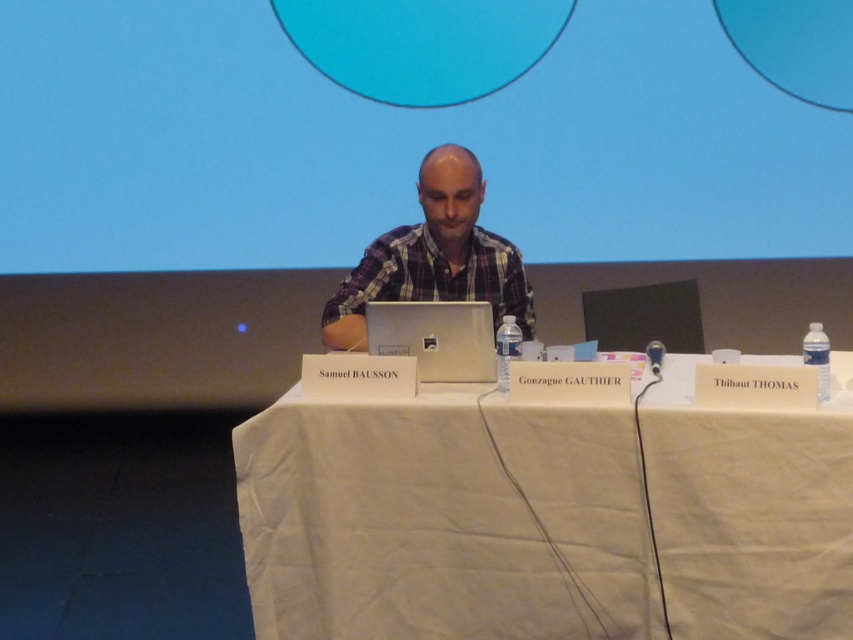
Is the position of plaid fabric shirt at center less distant than that of silver metallic laptop at center?

No.

Who is positioned more to the left, plaid fabric shirt at center or silver metallic laptop at center?

From the viewer's perspective, plaid fabric shirt at center appears more on the left side.

Is point (370, 300) farther from viewer compared to point (425, 369)?

Yes, point (370, 300) is farther from viewer.

You are a GUI agent. You are given a task and a screenshot of the screen. Output one action in this format:
    pyautogui.click(x=<x>, y=<y>)
    Task: Click on the plaid fabric shirt at center
    
    Given the screenshot: What is the action you would take?
    pyautogui.click(x=434, y=257)

Who is positioned more to the right, blue matte projection screen at upper center or plaid fabric shirt at center?

From the viewer's perspective, plaid fabric shirt at center appears more on the right side.

Based on the photo, can you confirm if blue matte projection screen at upper center is bigger than plaid fabric shirt at center?

Yes.

The width and height of the screenshot is (853, 640). Describe the element at coordinates (393, 145) in the screenshot. I see `blue matte projection screen at upper center` at that location.

At what (x,y) coordinates should I click in order to perform the action: click on blue matte projection screen at upper center. Please return your answer as a coordinate pair (x, y). Looking at the image, I should click on (393, 145).

Measure the distance between white cloth table at center and camera.

They are 1.79 meters apart.

Is white cloth table at center to the right of plaid fabric shirt at center from the viewer's perspective?

Indeed, white cloth table at center is positioned on the right side of plaid fabric shirt at center.

Where is `white cloth table at center`? white cloth table at center is located at coordinates (548, 516).